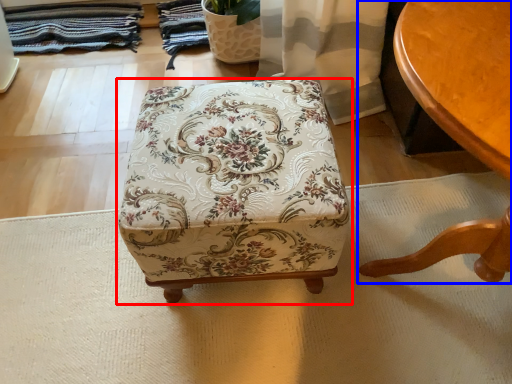
Question: Which of the following is the closest to the observer, furniture (highlighted by a red box) or table (highlighted by a blue box)?

Choices:
 (A) furniture
 (B) table

Answer: (B)